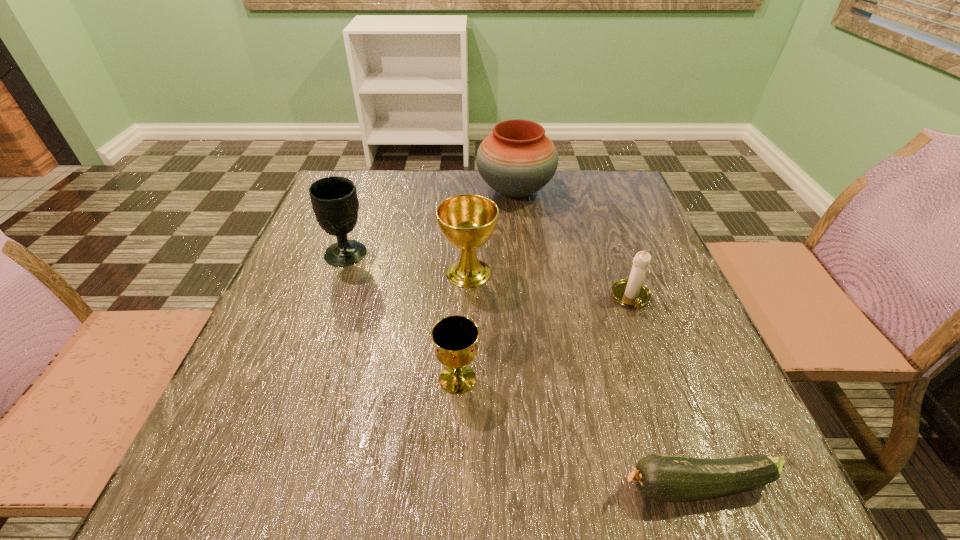
This screenshot has width=960, height=540. Identify the location of vacant space at the far edge of the desktop. (510, 213).

I want to click on free space at the near edge, so click(x=326, y=485).

Find the location of `vacant space at the left edge of the desktop`. vacant space at the left edge of the desktop is located at coordinates (360, 227).

Where is `vacant space at the right edge`? This screenshot has height=540, width=960. vacant space at the right edge is located at coordinates (625, 267).

Find the location of a particular element. The height and width of the screenshot is (540, 960). blank space at the far left corner of the desktop is located at coordinates (364, 212).

I want to click on vacant space at the near left corner of the desktop, so click(x=281, y=458).

This screenshot has height=540, width=960. I want to click on free space between the farthest object and the candle holder, so click(x=573, y=245).

Locate an element on the screen. vacant area that lies between the farthest object and the shortest object is located at coordinates (607, 339).

Where is `free space between the pottery and the leftmost object`? The height and width of the screenshot is (540, 960). free space between the pottery and the leftmost object is located at coordinates (431, 222).

Locate an element on the screen. The width and height of the screenshot is (960, 540). free spot between the shortest object and the farthest object is located at coordinates (607, 339).